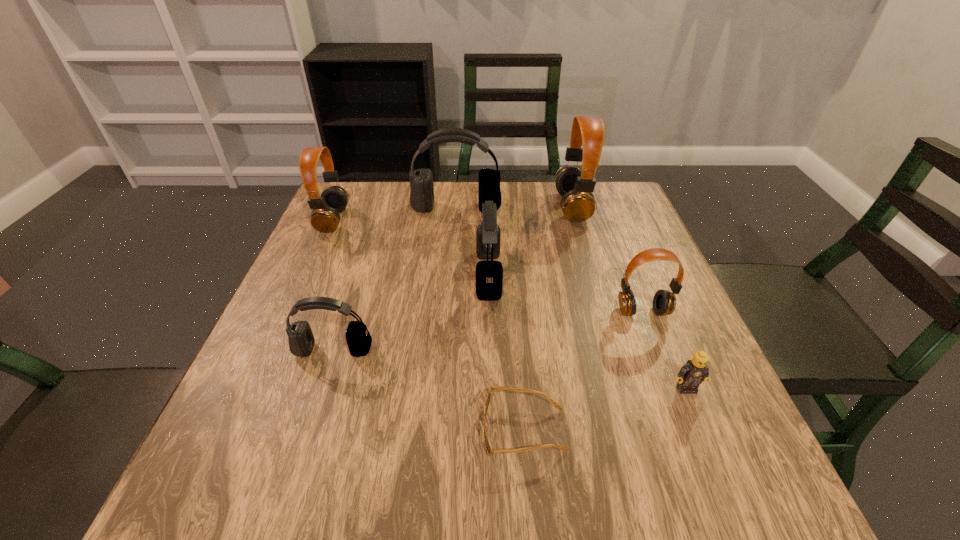
The height and width of the screenshot is (540, 960). What are the coordinates of `the shortest object` in the screenshot? It's located at (490, 451).

You are a GUI agent. You are given a task and a screenshot of the screen. Output one action in this format:
    pyautogui.click(x=<x>, y=<y>)
    Task: Click on the nearest object
    
    Given the screenshot: What is the action you would take?
    pyautogui.click(x=490, y=451)

Find the location of `free region located 0.160m on the ear cups of the biggest brown headset`. free region located 0.160m on the ear cups of the biggest brown headset is located at coordinates (500, 207).

This screenshot has height=540, width=960. In order to click on vacant space located 0.120m on the ear cups of the biggest brown headset in this screenshot , I will do `click(515, 207)`.

Locate an element on the screen. This screenshot has width=960, height=540. vacant space located on the ear cups of the biggest brown headset is located at coordinates (465, 207).

Identify the location of free space located on the headband of the farthest black headset. This screenshot has width=960, height=540. (450, 284).

What are the coordinates of `vacant space located 0.250m on the ear cups of the second smallest brown headset` in the screenshot? It's located at (x=438, y=220).

Locate an element on the screen. This screenshot has height=540, width=960. free spot located 0.370m on the headband of the second biggest black headset is located at coordinates 318,274.

Find the location of a particular element. This screenshot has width=960, height=540. vacant space located on the headband of the second biggest black headset is located at coordinates (438, 274).

I want to click on vacant region located on the headband of the second biggest black headset, so click(318, 274).